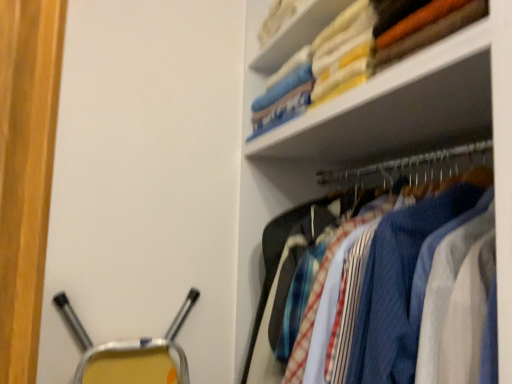
What do you see at coordinates (296, 34) in the screenshot?
I see `white fabric at upper right` at bounding box center [296, 34].

Measure the distance between soft cotton towels at upper right and camera.

1.02 meters.

Find the location of a particular element. white fabric at upper right is located at coordinates (296, 34).

Does point (322, 132) lie behind point (287, 45)?

No, it is in front of (287, 45).

Considering the relative sizes of textured fabric shirts at upper right and white fabric at upper right in the image provided, is textured fabric shirts at upper right taller than white fabric at upper right?

Correct, textured fabric shirts at upper right is much taller as white fabric at upper right.

Which object is closer to the camera, textured fabric shirts at upper right or white fabric at upper right?

textured fabric shirts at upper right is in front.

Where is `shelf in front of the white fabric at upper right`? The height and width of the screenshot is (384, 512). shelf in front of the white fabric at upper right is located at coordinates (395, 141).

Is white fabric at upper right turned away from soft cotton towels at upper right?

white fabric at upper right is not turned away from soft cotton towels at upper right.

Which of these two, white fabric at upper right or soft cotton towels at upper right, stands taller?

soft cotton towels at upper right.

In the scene shown: How many degrees apart are the facing directions of white fabric at upper right and soft cotton towels at upper right?

They differ by 0.0015 degrees in their facing directions.

Between white fabric at upper right and soft cotton towels at upper right, which one has smaller size?

soft cotton towels at upper right.

Which object is positioned more to the right, soft cotton towels at upper right or white fabric at upper right?

From the viewer's perspective, soft cotton towels at upper right appears more on the right side.

What's the angular difference between soft cotton towels at upper right and white fabric at upper right's facing directions?

0.0015 degrees separate the facing orientations of soft cotton towels at upper right and white fabric at upper right.

Based on the photo, is soft cotton towels at upper right next to white fabric at upper right?

soft cotton towels at upper right and white fabric at upper right are clearly separated.

Consider the image. From a real-world perspective, which object rests below the other?

textured fabric shirts at upper right, from a real-world perspective.

Can you tell me how much white fabric at upper right and textured fabric shirts at upper right differ in facing direction?

white fabric at upper right and textured fabric shirts at upper right are facing 4.24 degrees away from each other.

Can you confirm if white fabric at upper right is smaller than textured fabric shirts at upper right?

Correct, white fabric at upper right occupies less space than textured fabric shirts at upper right.

You are a GUI agent. You are given a task and a screenshot of the screen. Output one action in this format:
    pyautogui.click(x=<x>, y=<y>)
    Task: Click on the shelf that appears on the right of soft cotton towels at upper right
    This screenshot has height=384, width=512.
    Given the screenshot: What is the action you would take?
    pyautogui.click(x=395, y=141)

Visually, is textured fabric shirts at upper right positioned to the left or to the right of soft cotton towels at upper right?

Based on their positions, textured fabric shirts at upper right is located to the right of soft cotton towels at upper right.

Consider the image. Does textured fabric shirts at upper right come in front of soft cotton towels at upper right?

Yes, it is.

Who is shorter, soft cotton towels at upper right or textured fabric shirts at upper right?

soft cotton towels at upper right.

Is soft cotton towels at upper right bigger than textured fabric shirts at upper right?

No, soft cotton towels at upper right is not bigger than textured fabric shirts at upper right.

Is soft cotton towels at upper right oriented towards textured fabric shirts at upper right?

No, soft cotton towels at upper right is not turned towards textured fabric shirts at upper right.

Which is correct: soft cotton towels at upper right is inside textured fabric shirts at upper right, or outside of it?

The correct answer is: outside.

Locate an element on the screen. This screenshot has width=512, height=384. shelf in front of the white fabric at upper right is located at coordinates (395, 141).

I want to click on laundry below the white fabric at upper right (from the image's perspective), so click(x=432, y=34).

Based on their spatial positions, is soft cotton towels at upper right or white fabric at upper right further from textured fabric shirts at upper right?

soft cotton towels at upper right lies further to textured fabric shirts at upper right than the other object.

Looking at the image, which one is located further to soft cotton towels at upper right, white fabric at upper right or textured fabric shirts at upper right?

The object further to soft cotton towels at upper right is textured fabric shirts at upper right.

Based on their spatial positions, is textured fabric shirts at upper right or soft cotton towels at upper right further from white fabric at upper right?

textured fabric shirts at upper right lies further to white fabric at upper right than the other object.

From the image, which object appears to be nearer to white fabric at upper right, soft cotton towels at upper right or textured fabric shirts at upper right?

The object closer to white fabric at upper right is soft cotton towels at upper right.

Considering their positions, is white fabric at upper right positioned further to textured fabric shirts at upper right than soft cotton towels at upper right?

→ soft cotton towels at upper right.

Looking at the image, which one is located closer to soft cotton towels at upper right, textured fabric shirts at upper right or white fabric at upper right?

white fabric at upper right is closer to soft cotton towels at upper right.

The image size is (512, 384). Find the location of `laundry between white fabric at upper right and textured fabric shirts at upper right vertically`. laundry between white fabric at upper right and textured fabric shirts at upper right vertically is located at coordinates click(432, 34).